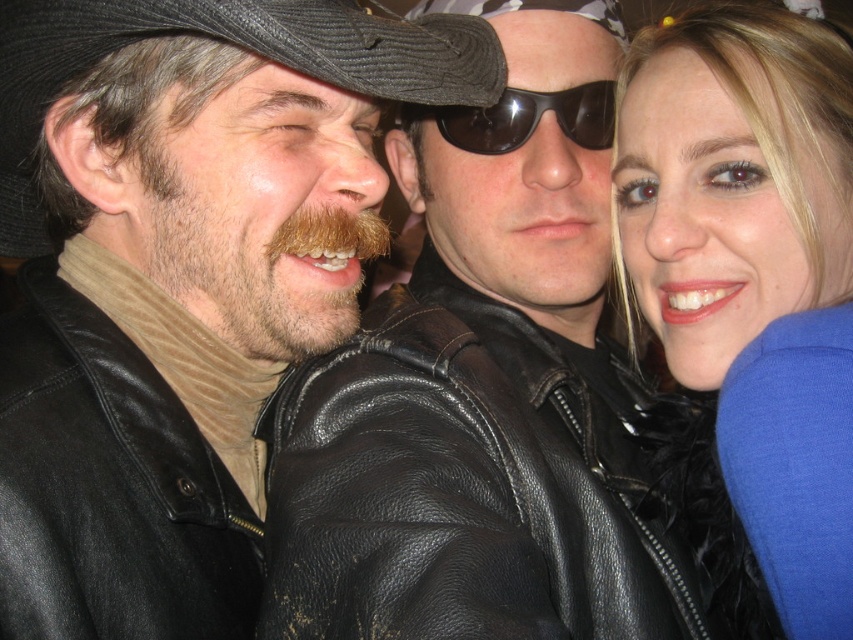
You are a photographer trying to adjust the lighting for a closeup shot of the three people in the image. You need to ensure that the black corduroy hat at upper left and the black matte sunglasses at center are both clearly visible. Given their size difference, which object might require more focused lighting to avoid being overshadowed?

The black matte sunglasses at center might require more focused lighting since they are smaller in size compared to the black corduroy hat at upper left, making them easier to be overshadowed in the lighting setup.

You are a photographer trying to adjust the focus of your camera. The black leather jacket at center and the black corduroy hat at upper left are in the frame. Based on their positions, which object should be closer to the camera lens?

The black corduroy hat at upper left is closer to the camera lens because it is only 18.17 inches away from the black leather jacket at center, meaning the hat is nearer in the scene.

You are standing at the point marked by the coordinates point (410, 417) in the image. You want to take a photo of the three people in the scene. Can you fit all three people into your camera frame if your camera has a 60 degree field of view?

Yes, since the point marked by the coordinates point (410, 417) is 3.28 feet away from the viewer, and the three people are positioned closely together, they would likely fit within a 60 degree field of view when photographed from that distance.